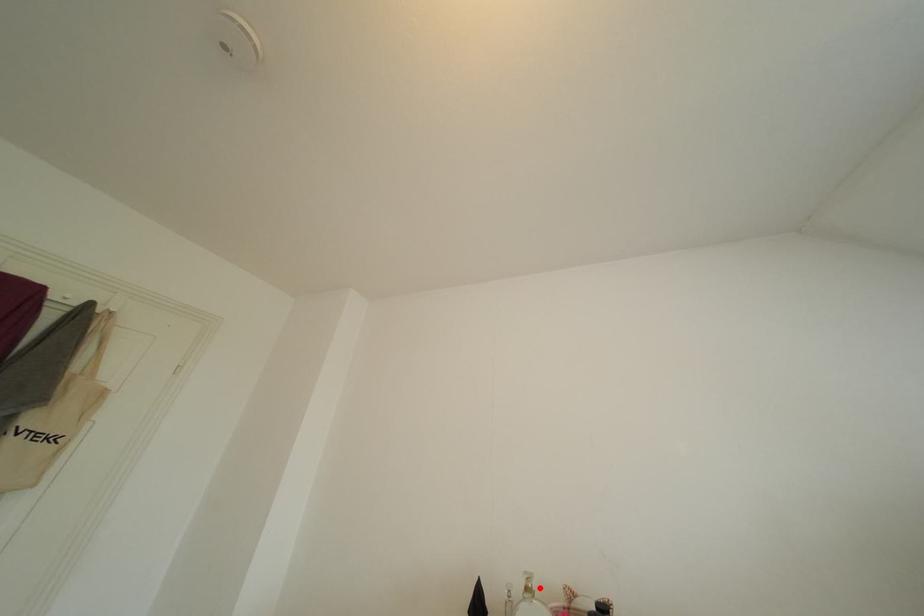
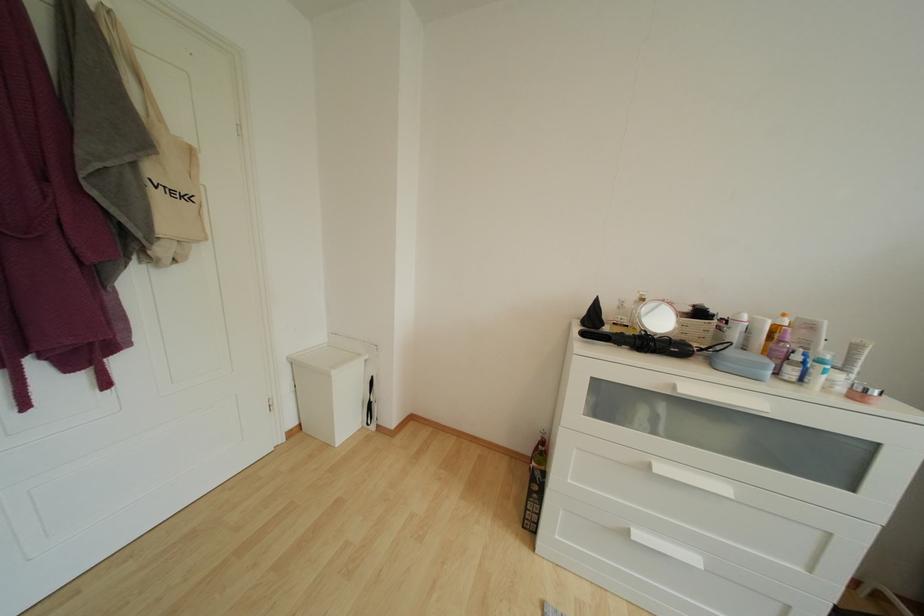
Locate, in the second image, the point that corresponds to the highlighted location in the first image.

(651, 301)